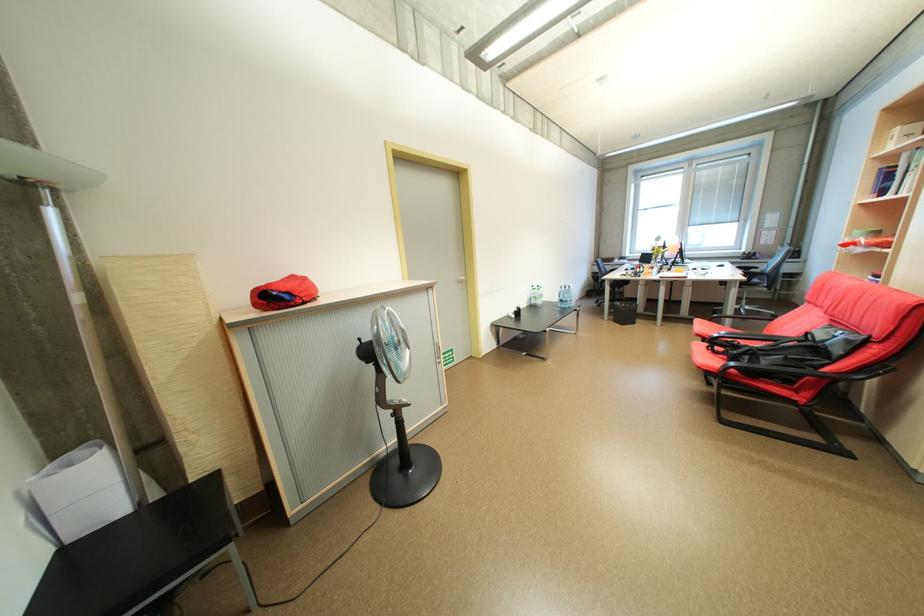
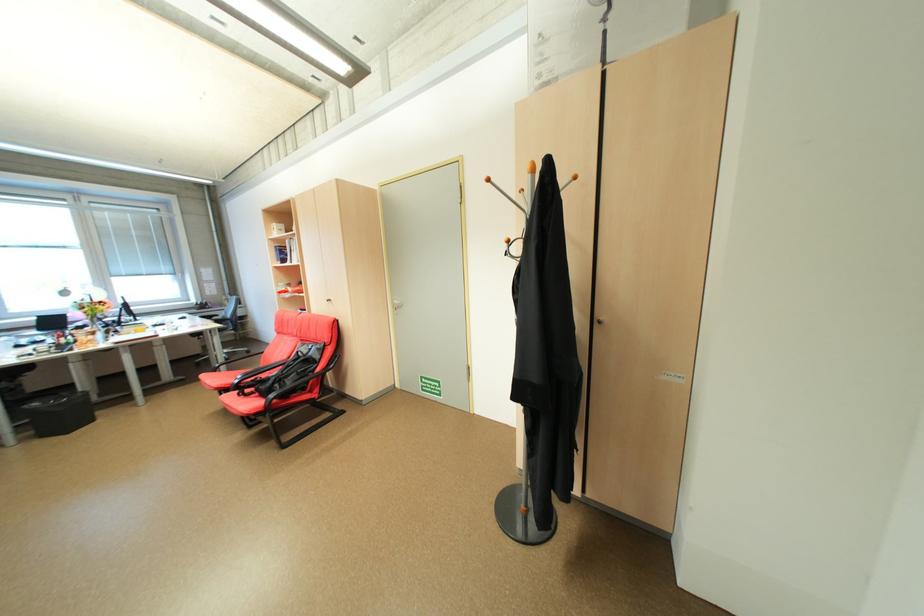
Find the pixel in the second image that matches pixel 756 358 in the first image.

(286, 386)